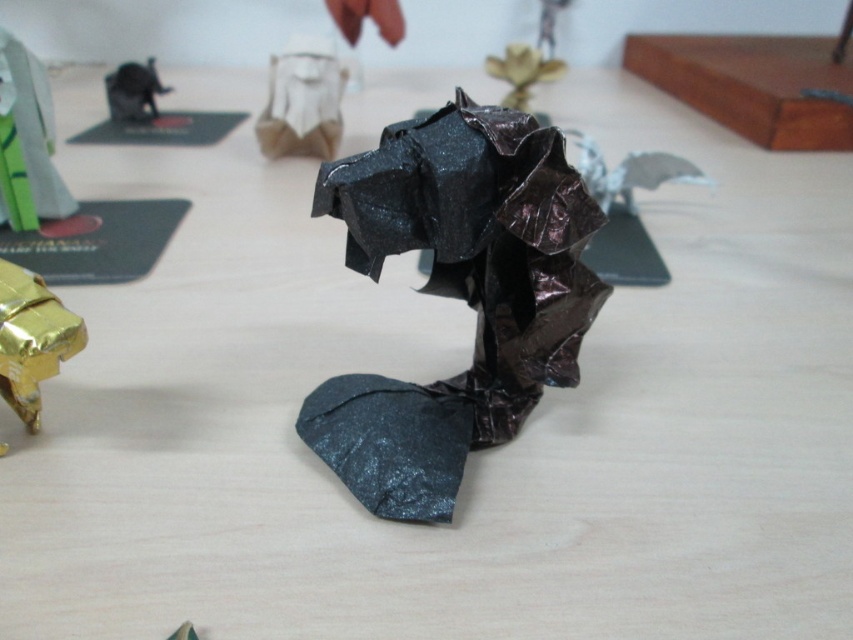
Based on the photo, you are a child who wants to place a new origami crane between the shiny black origami elephant at center and the gold robot at left. The crane is 10 inches long. Is there enough space between them to fit the crane?

The distance between the shiny black origami elephant at center and the gold robot at left is 39.22 inches. Since the crane is only 10 inches long, there is sufficient space to place it between them.

You are an artist planning to add a new origami piece to the display. You want to place it between the matte green paper at upper left and the matte black elephant at upper left. Based on their positions, which object should you place your new piece closer to in order to maintain a balanced arrangement?

Since the matte green paper at upper left is closer to the viewer than the matte black elephant at upper left, placing the new piece closer to the matte black elephant at upper left will help maintain a balanced arrangement by compensating for the distance difference between the two objects.

You are an art curator examining the origami display. You need to determine the spatial relationship between the shiny black origami elephant at center and the shiny metallic bird at center. Which object is placed above the other?

The shiny metallic bird at center is placed above the shiny black origami elephant at center because the description states that the elephant is positioned under the bird.